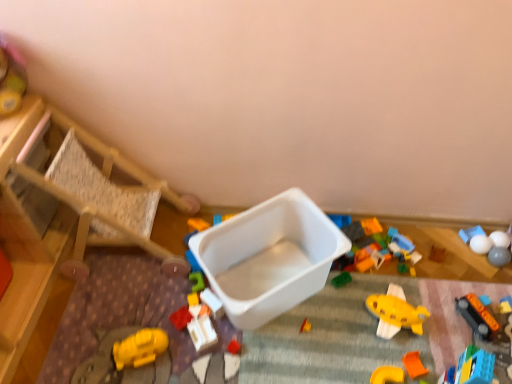
I want to click on vacant area that lies between orange matte plastic toy at lower right, which is counted as the 5th toy, starting from the left, and rubberized plastic toy at center, which ranks as the 2th toy in left-to-right order, so click(x=298, y=355).